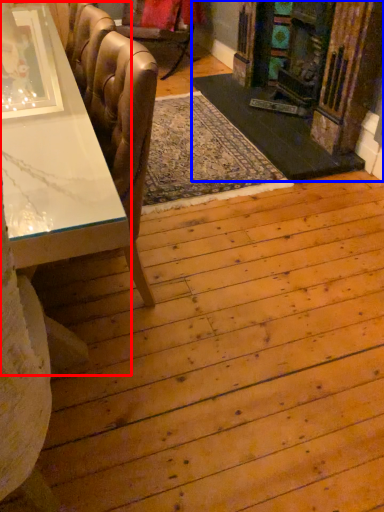
Question: Which object is closer to the camera taking this photo, table (highlighted by a red box) or fireplace (highlighted by a blue box)?

Choices:
 (A) table
 (B) fireplace

Answer: (A)